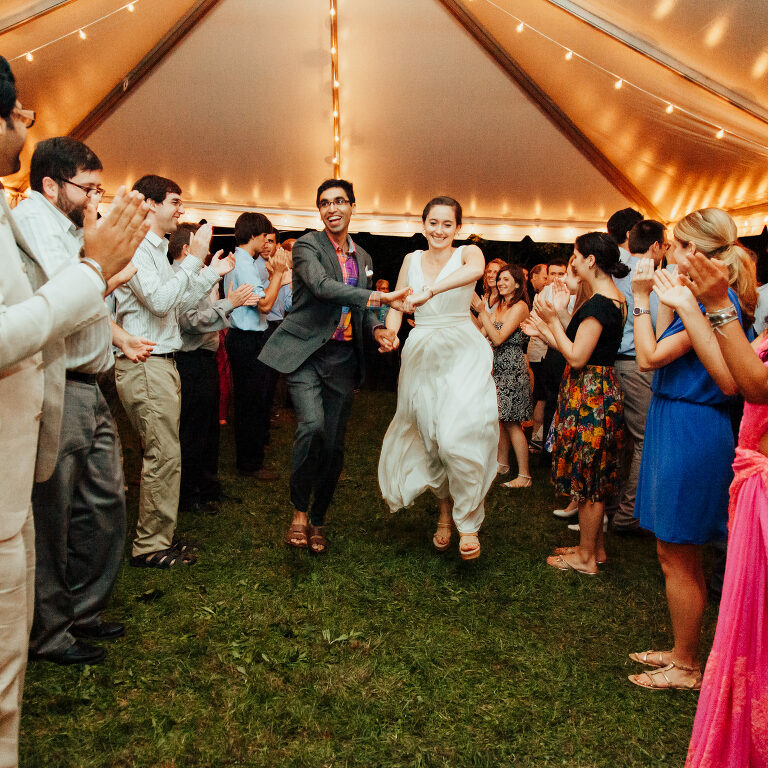
Locate an element on the screen. The width and height of the screenshot is (768, 768). string of lights is located at coordinates (335, 114), (541, 220), (680, 144), (78, 50).